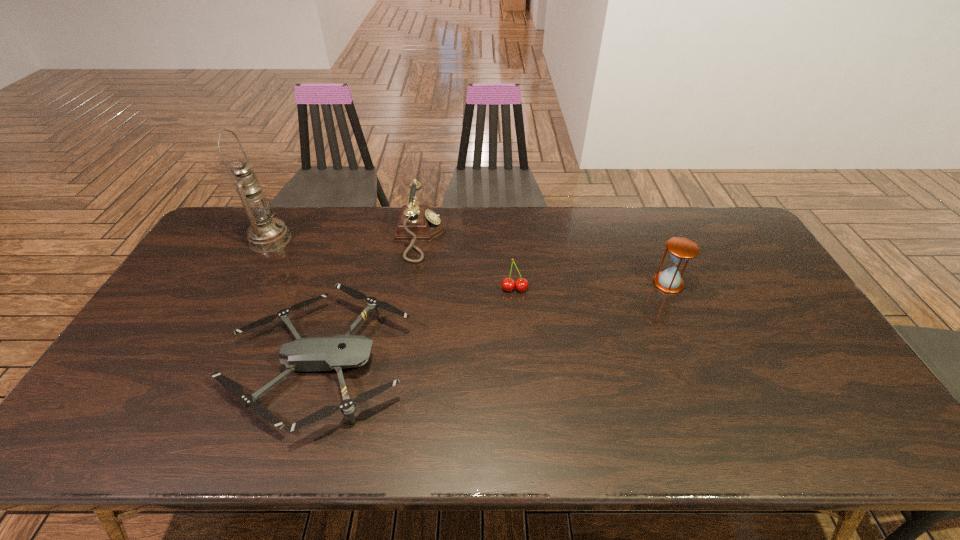
At what (x,y) coordinates should I click in order to perform the action: click on vacant space at the right edge of the desktop. Please return your answer as a coordinate pair (x, y). The width and height of the screenshot is (960, 540). Looking at the image, I should click on (718, 259).

You are a GUI agent. You are given a task and a screenshot of the screen. Output one action in this format:
    pyautogui.click(x=<x>, y=<y>)
    Task: Click on the free region at the far left corner of the desktop
    This screenshot has height=540, width=960.
    Given the screenshot: What is the action you would take?
    pyautogui.click(x=235, y=227)

This screenshot has height=540, width=960. In order to click on vacant space in between the telephone and the fourth tallest object in this screenshot , I will do `click(468, 262)`.

This screenshot has height=540, width=960. Identify the location of vacant area that lies between the tallest object and the shortest object. (295, 301).

Locate an element on the screen. vacant region between the cherry and the telephone is located at coordinates (468, 262).

Where is `vacant point located between the telephone and the tallest object`? vacant point located between the telephone and the tallest object is located at coordinates (346, 238).

I want to click on unoccupied area between the second shortest object and the tallest object, so click(393, 264).

I want to click on vacant point located between the telephone and the second object from right to left, so click(x=468, y=262).

Identify the location of vacant space that is in between the oil lamp and the hourglass. (469, 261).

The height and width of the screenshot is (540, 960). In order to click on vacant space in between the shortest object and the oil lamp in this screenshot , I will do `click(295, 301)`.